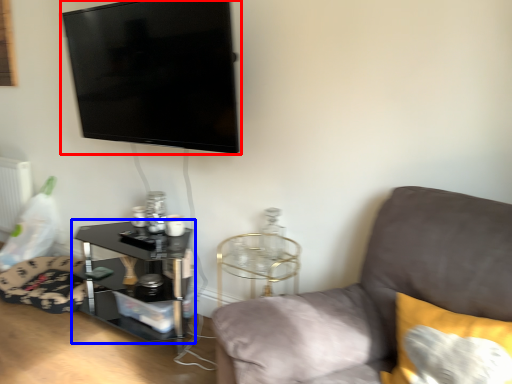
Question: Which object is further to the camera taking this photo, television (highlighted by a red box) or table (highlighted by a blue box)?

Choices:
 (A) television
 (B) table

Answer: (B)